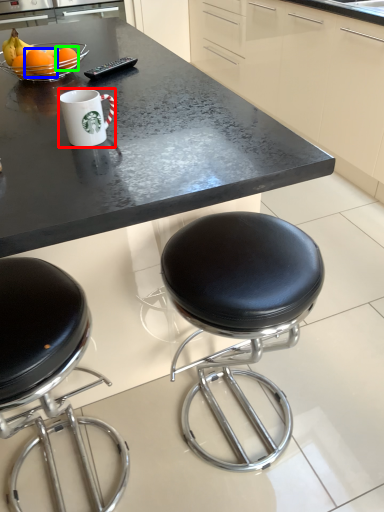
Question: Which is farther away from coffee cup (highlighted by a red box)? orange (highlighted by a blue box) or orange (highlighted by a green box)?

Choices:
 (A) orange
 (B) orange

Answer: (B)